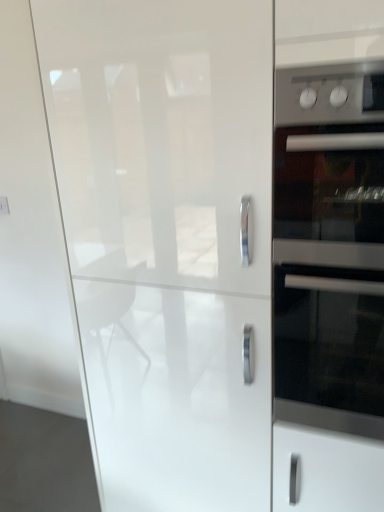
Question: Can you confirm if stainless steel oven at right is positioned to the left of satin silver oven at right?

Choices:
 (A) no
 (B) yes

Answer: (A)

Question: From the image's perspective, does stainless steel oven at right appear lower than satin silver oven at right?

Choices:
 (A) yes
 (B) no

Answer: (A)

Question: Are stainless steel oven at right and satin silver oven at right far apart?

Choices:
 (A) yes
 (B) no

Answer: (B)

Question: From a real-world perspective, is stainless steel oven at right positioned over satin silver oven at right based on gravity?

Choices:
 (A) no
 (B) yes

Answer: (A)

Question: Can you confirm if stainless steel oven at right is shorter than satin silver oven at right?

Choices:
 (A) yes
 (B) no

Answer: (B)

Question: Is stainless steel oven at right positioned behind satin silver oven at right?

Choices:
 (A) yes
 (B) no

Answer: (A)

Question: From a real-world perspective, does satin silver oven at right stand above stainless steel oven at right?

Choices:
 (A) no
 (B) yes

Answer: (B)

Question: Could you tell me if satin silver oven at right is turned towards stainless steel oven at right?

Choices:
 (A) no
 (B) yes

Answer: (A)

Question: Does satin silver oven at right touch stainless steel oven at right?

Choices:
 (A) yes
 (B) no

Answer: (A)

Question: Considering the relative positions of satin silver oven at right and stainless steel oven at right in the image provided, is satin silver oven at right to the left of stainless steel oven at right from the viewer's perspective?

Choices:
 (A) no
 (B) yes

Answer: (B)

Question: Does satin silver oven at right appear on the right side of stainless steel oven at right?

Choices:
 (A) no
 (B) yes

Answer: (A)

Question: Considering the relative sizes of satin silver oven at right and stainless steel oven at right in the image provided, is satin silver oven at right taller than stainless steel oven at right?

Choices:
 (A) yes
 (B) no

Answer: (B)

Question: Is glossy white cabinet at center surrounding satin silver oven at right?

Choices:
 (A) yes
 (B) no

Answer: (B)